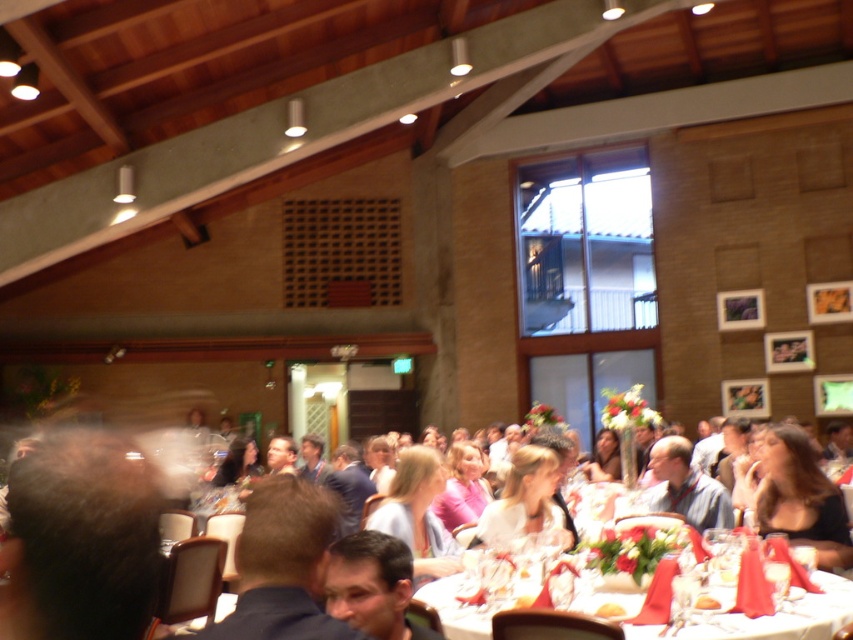
You are a guest at the event and want to locate the dessert table. You see the white tablecloth at center and the yellow cake at center. Which object is positioned to the right of the other?

The white tablecloth at center is to the right of the yellow cake at center.

You are a server at the event and need to place a new white glossy bread at lower right on the white tablecloth at center. Will the bread fit entirely on the tablecloth without hanging over the edges?

The white tablecloth at center has a larger width than the white glossy bread at lower right, so the bread will fit entirely on the tablecloth without hanging over the edges.

You are standing at the entrance of the hall and want to take a photo of the point at coordinates point (624, 609). Your camera has a focal length of 50mm and a sensor size of 24mm. What is the minimum distance you need to move forward to ensure the point is within the camera frame?

The point at coordinates point (624, 609) is 3.03 meters away from the camera. To ensure it is within the frame, you need to move forward until the distance is less than or equal to the camera sensor size divided by the focal length multiplied by the sensor size. However, without specific field of view calculations, the current distance of 3.03 meters may already be within the frame. Further calculations are needed for precise adjustment.